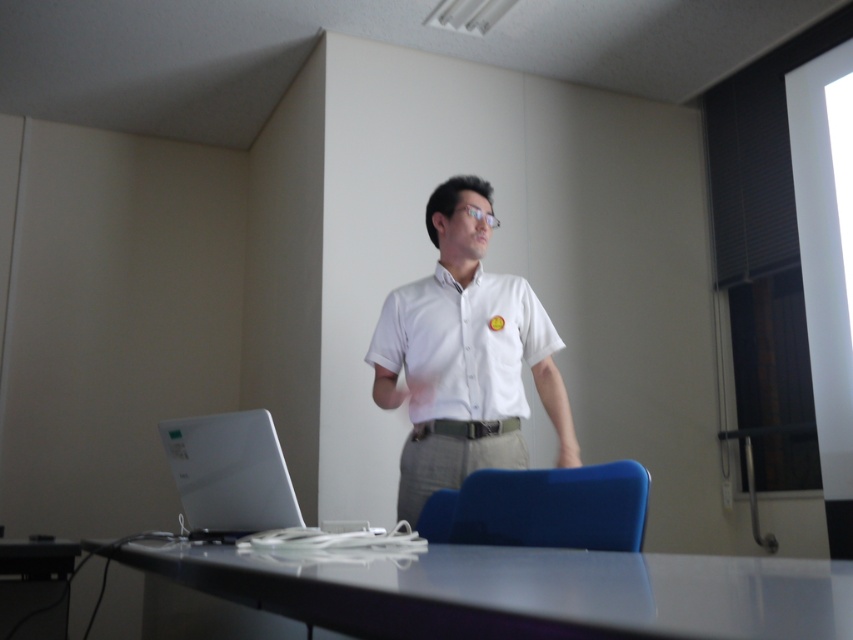
Question: Observing the image, what is the correct spatial positioning of white smooth shirt at center in reference to sleek silver laptop at lower left?

Choices:
 (A) below
 (B) above

Answer: (B)

Question: Which point is farther from the camera taking this photo?

Choices:
 (A) (683, 580)
 (B) (248, 500)
 (C) (480, 352)

Answer: (C)

Question: Is white glossy table at lower center positioned in front of sleek silver laptop at lower left?

Choices:
 (A) yes
 (B) no

Answer: (A)

Question: Based on their relative distances, which object is farther from the white smooth shirt at center?

Choices:
 (A) sleek silver laptop at lower left
 (B) white glossy table at lower center

Answer: (B)

Question: Among these points, which one is nearest to the camera?

Choices:
 (A) (543, 374)
 (B) (234, 502)
 (C) (490, 336)

Answer: (B)

Question: Can you confirm if white glossy table at lower center is positioned above sleek silver laptop at lower left?

Choices:
 (A) no
 (B) yes

Answer: (A)